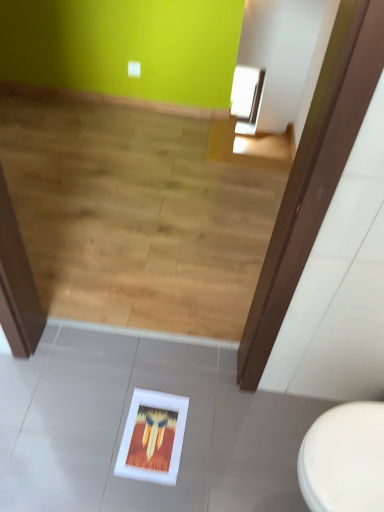
Locate an element on the screen. vacant space in white matte picture frame at lower center (from a real-world perspective) is located at coordinates (152, 438).